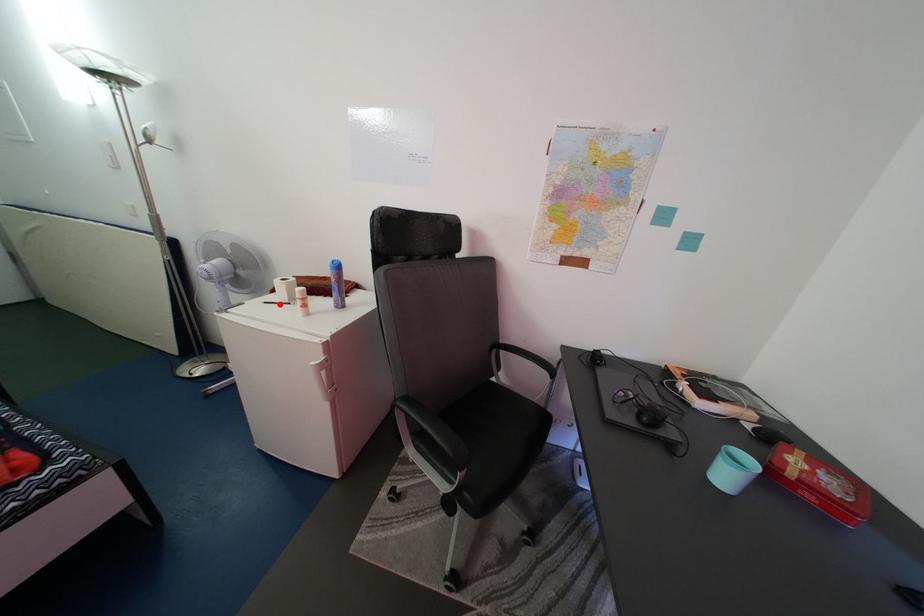
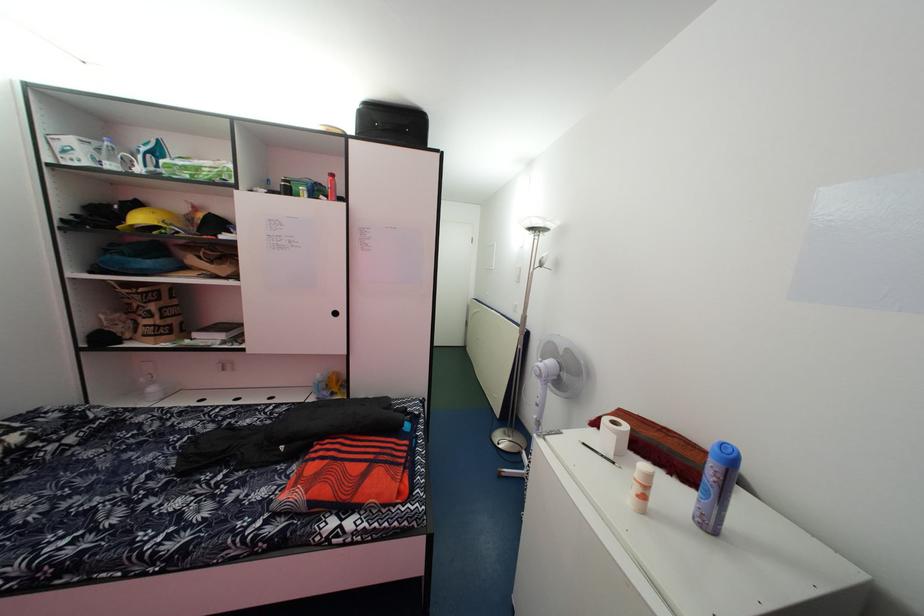
In the second image, find the point that corresponds to the highlighted location in the first image.

(600, 442)